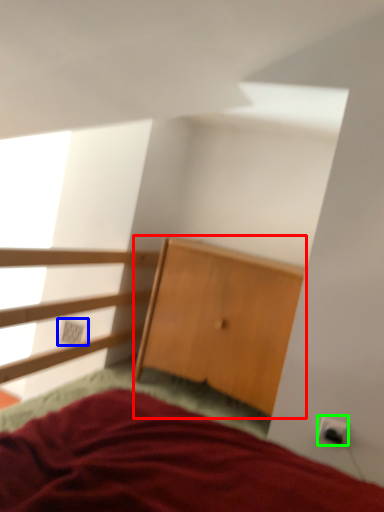
Question: Which object is positioned farthest from dresser (highlighted by a red box)? Select from electric outlet (highlighted by a blue box) and electric outlet (highlighted by a green box).

Choices:
 (A) electric outlet
 (B) electric outlet

Answer: (A)